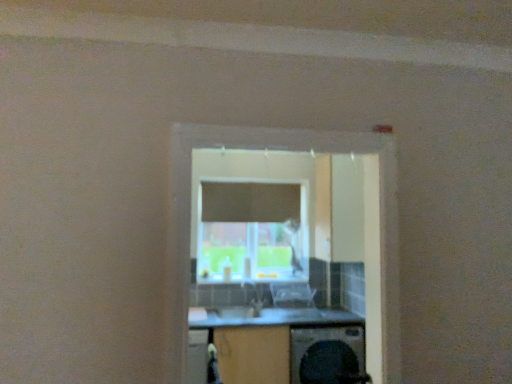
Question: Is clear plastic chair at center not within wooden at center?

Choices:
 (A) no
 (B) yes

Answer: (B)

Question: Does clear plastic chair at center have a larger size compared to wooden at center?

Choices:
 (A) no
 (B) yes

Answer: (A)

Question: Is clear plastic chair at center turned away from wooden at center?

Choices:
 (A) yes
 (B) no

Answer: (B)

Question: Can you confirm if clear plastic chair at center is thinner than wooden at center?

Choices:
 (A) yes
 (B) no

Answer: (A)

Question: Is clear plastic chair at center to the left of wooden at center from the viewer's perspective?

Choices:
 (A) no
 (B) yes

Answer: (A)

Question: Does clear plastic chair at center lie behind wooden at center?

Choices:
 (A) no
 (B) yes

Answer: (B)

Question: Can you confirm if black plastic washing machine at lower center is positioned to the right of wooden at center?

Choices:
 (A) no
 (B) yes

Answer: (B)

Question: Does black plastic washing machine at lower center have a lesser height compared to wooden at center?

Choices:
 (A) no
 (B) yes

Answer: (B)

Question: Is the depth of black plastic washing machine at lower center greater than that of wooden at center?

Choices:
 (A) yes
 (B) no

Answer: (A)

Question: Is black plastic washing machine at lower center positioned before wooden at center?

Choices:
 (A) no
 (B) yes

Answer: (A)

Question: Is black plastic washing machine at lower center far from wooden at center?

Choices:
 (A) no
 (B) yes

Answer: (A)

Question: Is black plastic washing machine at lower center wider than wooden at center?

Choices:
 (A) no
 (B) yes

Answer: (B)

Question: From a real-world perspective, does wooden at center stand above transparent glass window at center?

Choices:
 (A) yes
 (B) no

Answer: (B)